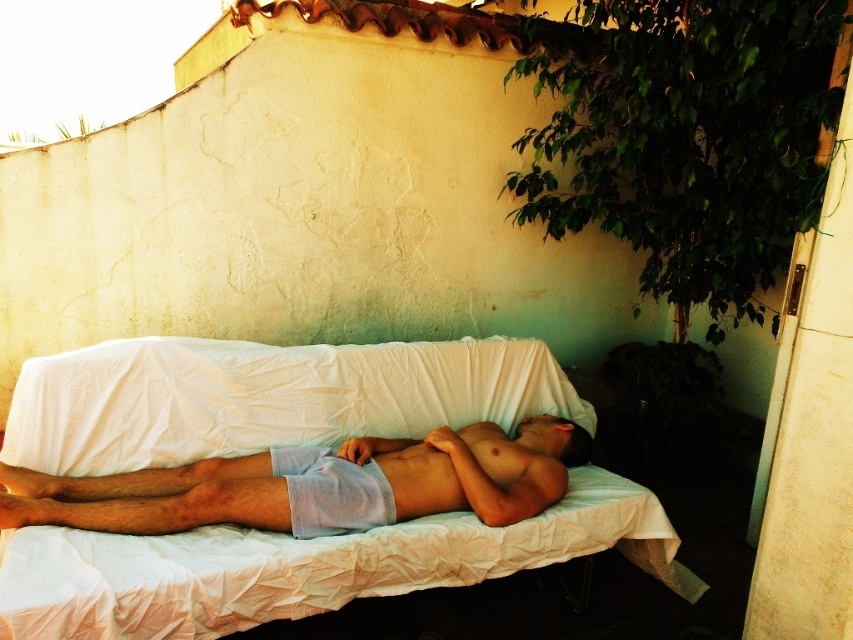
You are standing in the outdoor space where the man is resting. You want to place a small table exactly at the point labeled as point (305, 419). If the table is 1.5 meters wide, will it fit without overlapping the potted plant to the right of the bed?

The point (305, 419) is 3.29 meters from the viewer. However, the provided information does not specify the distance or position of the potted plant relative to this point, so it is impossible to determine if the table will overlap with the potted plant without additional details.

You are a photographer adjusting your camera to capture the scene. You notice two points in the image at coordinates point (305, 584) and point (561, 476). Which point should you focus on to ensure it appears sharper in the photo if you want to prioritize the closer object?

You should focus on point (305, 584) because it is closer to the camera than point (561, 476), so it will appear sharper when focused on.